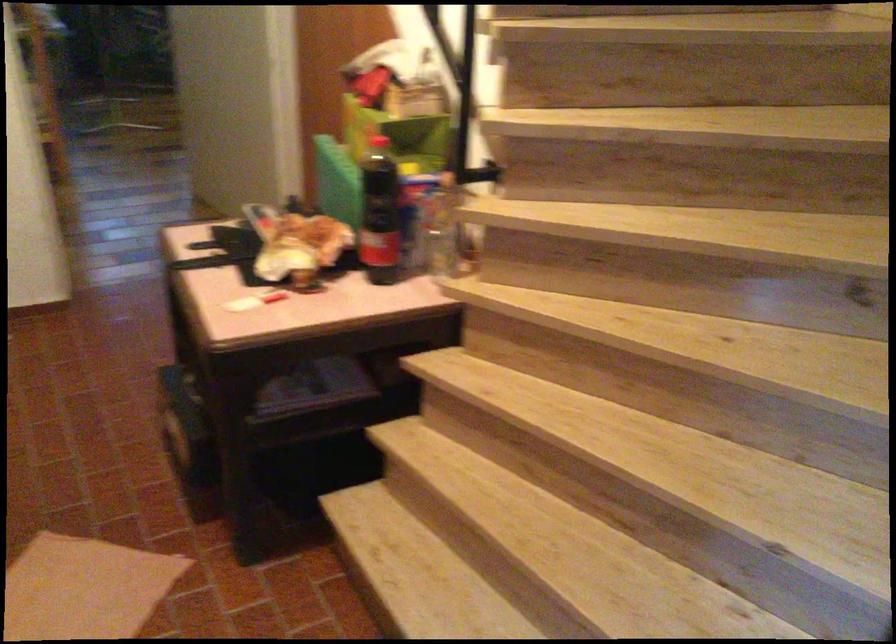
Find the location of a particular element. piece of cardboard is located at coordinates (83, 589).